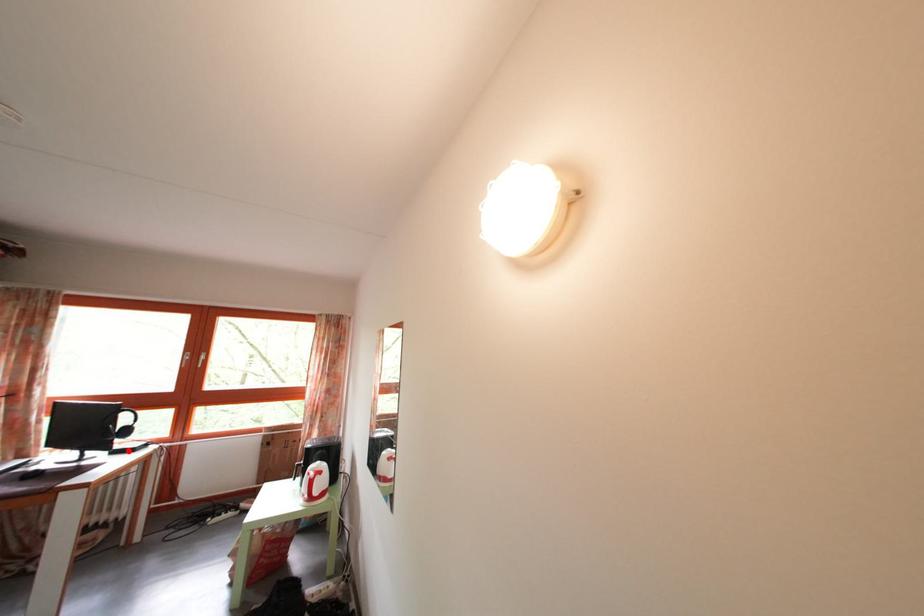
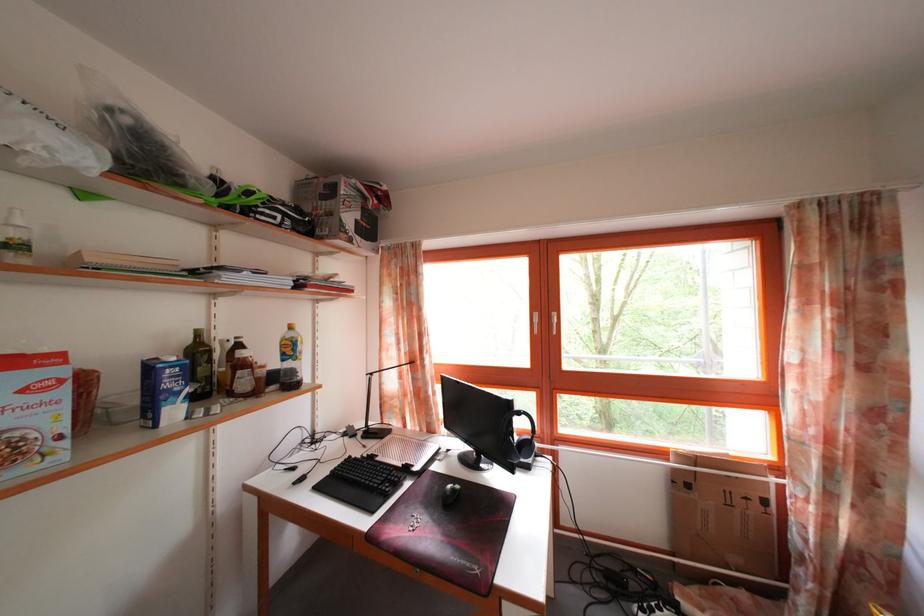
The point at the highlighted location is marked in the first image. Where is the corresponding point in the second image?

(525, 467)